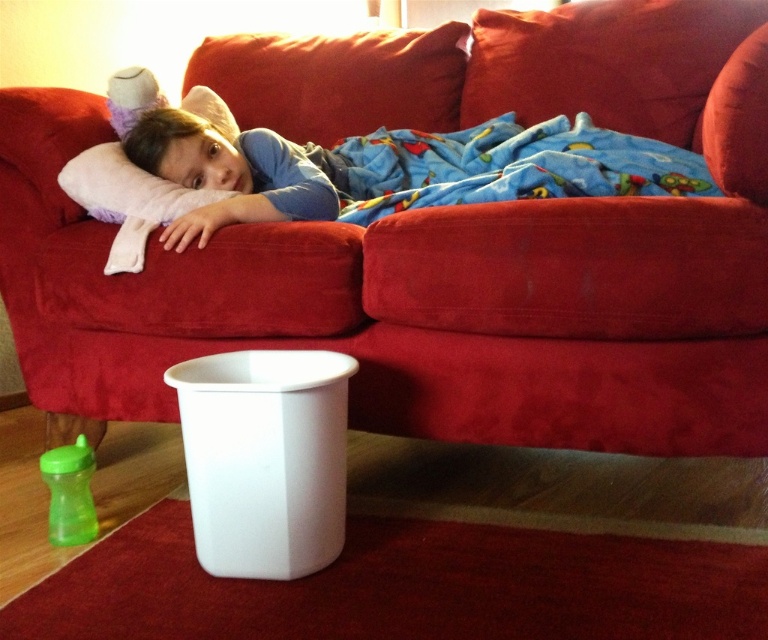
Question: Which is farther from the velvet red couch at upper center?

Choices:
 (A) matte blue shirt at upper center
 (B) green plastic sippy cup at lower left
 (C) blue fleece blanket at upper center

Answer: (B)

Question: Does matte blue shirt at upper center appear on the left side of green plastic sippy cup at lower left?

Choices:
 (A) yes
 (B) no

Answer: (B)

Question: Which point is farther to the camera?

Choices:
 (A) (157, 205)
 (B) (60, 486)
 (C) (414, 112)
 (D) (677, 154)

Answer: (C)

Question: Does blue fleece blanket at upper center lie behind green plastic sippy cup at lower left?

Choices:
 (A) no
 (B) yes

Answer: (B)

Question: Which point is closer to the camera?

Choices:
 (A) velvet red couch at upper center
 (B) matte blue shirt at upper center
 (C) blue fleece blanket at upper center
 (D) green plastic sippy cup at lower left

Answer: (A)

Question: Is blue fleece blanket at upper center thinner than matte blue shirt at upper center?

Choices:
 (A) no
 (B) yes

Answer: (A)